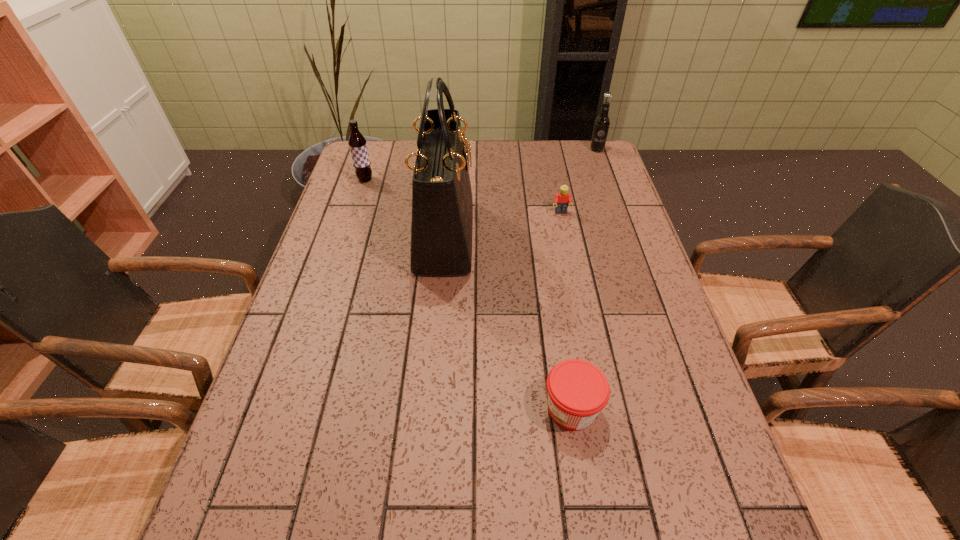
Locate an element on the screen. empty location between the nearest object and the tallest object is located at coordinates (508, 322).

Where is `free space between the jam and the Lego`? The height and width of the screenshot is (540, 960). free space between the jam and the Lego is located at coordinates (566, 310).

Identify the location of object that stands as the second closest to the fourth nearest object. (561, 200).

Where is `object that is the third closest to the jam`? The image size is (960, 540). object that is the third closest to the jam is located at coordinates (357, 143).

The width and height of the screenshot is (960, 540). I want to click on vacant region that satisfies the following two spatial constraints: 1. on the label of the rightmost object; 2. on the label side of the nearest object, so click(689, 409).

Identify the location of vacant region that satisfies the following two spatial constraints: 1. on the face of the Lego; 2. on the label side of the jam. (601, 409).

What are the coordinates of `vacant point that satisfies the following two spatial constraints: 1. on the label of the rightmost object; 2. at the front of the fourth object from right to left with visible charms` in the screenshot? It's located at (628, 235).

Find the location of a particular element. Image resolution: width=960 pixels, height=540 pixels. free space that satisfies the following two spatial constraints: 1. on the face of the Lego; 2. at the front of the tallest object with visible charms is located at coordinates (565, 235).

The width and height of the screenshot is (960, 540). In order to click on free spot that satisfies the following two spatial constraints: 1. on the face of the Lego; 2. on the label side of the jam in this screenshot , I will do `click(601, 409)`.